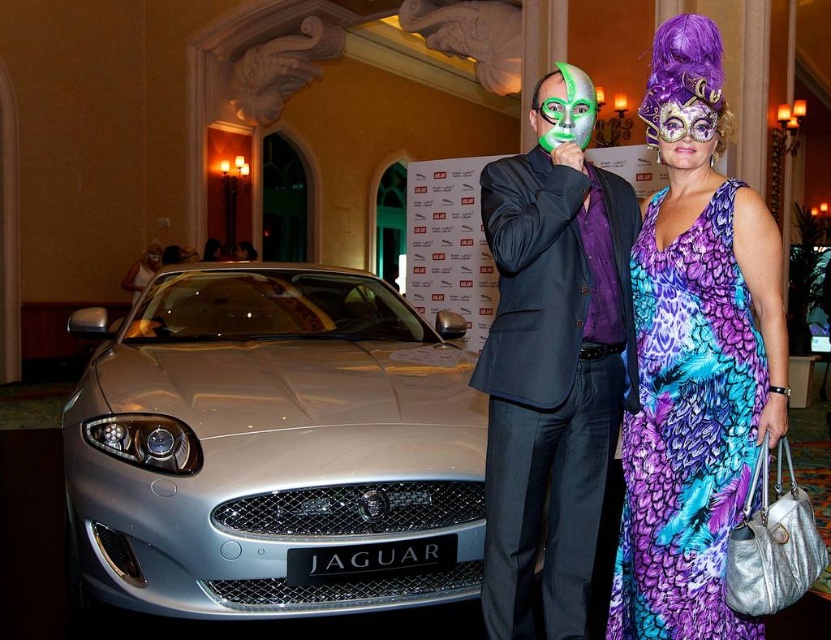
You are standing in front of the silver metallic jaguar at center. Which direction should you walk to reach the person on the left?

The silver metallic jaguar at center is located at point (x=274, y=449). Since the person on the left is positioned to the left side of the jaguar, you should walk to the left to reach them.

You are a photographer at the event and need to capture a photo where both the silver metallic jaguar at center and the purple shiny mask at upper right are clearly visible. Given their height difference, which object might require you to adjust your camera angle to ensure it is fully in frame?

The silver metallic jaguar at center is taller than the purple shiny mask at upper right, so you might need to adjust your camera angle to ensure the silver metallic jaguar at center is fully in frame.

You are standing in front of the Jaguar car at the exhibition. There are two points marked in the scene. The first point is at coordinates point (750, 326) and the second is at point (581, 72). Which of these points is nearer to you?

Point (750, 326) is closer to the viewer than point (581, 72).